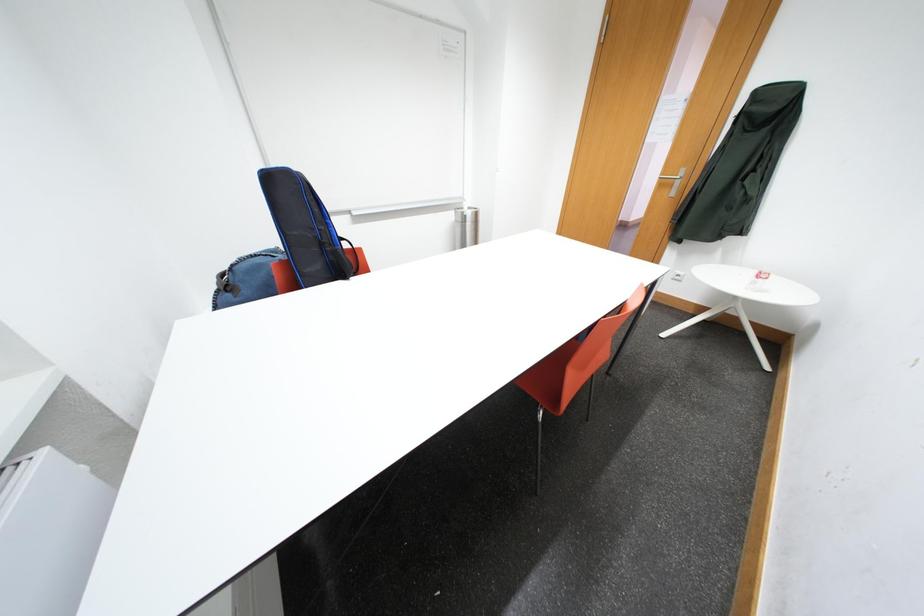
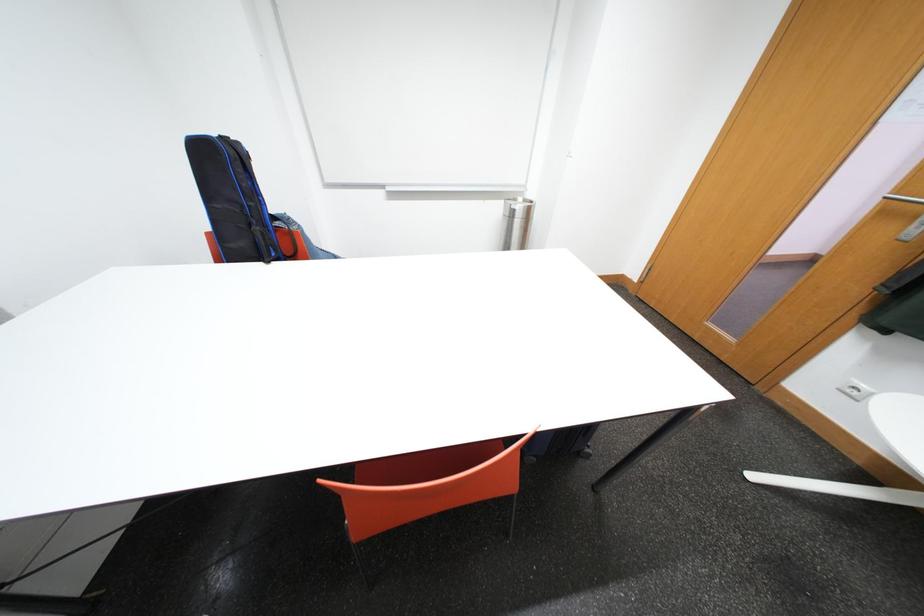
Question: The first image is from the beginning of the video and the second image is from the end. How did the camera likely rotate when shooting the video?

Choices:
 (A) Left
 (B) Right
 (C) Up
 (D) Down

Answer: (A)